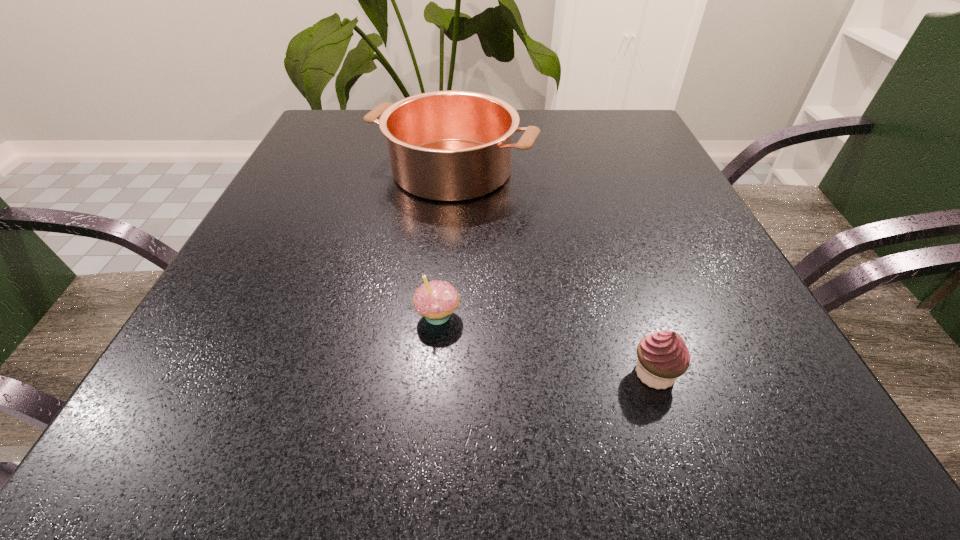
This screenshot has height=540, width=960. What are the coordinates of `the tallest object` in the screenshot? It's located at (450, 146).

What are the coordinates of `saucepan` in the screenshot? It's located at (450, 146).

The height and width of the screenshot is (540, 960). Identify the location of the second farthest object. (436, 300).

Identify the location of the left cupcake. (436, 300).

Find the location of a particular element. The image size is (960, 540). the right cupcake is located at coordinates (663, 356).

What are the coordinates of `the nearest object` in the screenshot? It's located at (663, 356).

The image size is (960, 540). In order to click on free space located on the right of the farthest object in this screenshot , I will do 581,170.

The height and width of the screenshot is (540, 960). In order to click on vacant space located 0.110m on the left of the left cupcake in this screenshot , I will do `click(342, 315)`.

Find the location of a particular element. Image resolution: width=960 pixels, height=540 pixels. vacant space located on the back of the nearer cupcake is located at coordinates (626, 287).

Where is `object at the far edge`? Image resolution: width=960 pixels, height=540 pixels. object at the far edge is located at coordinates (450, 146).